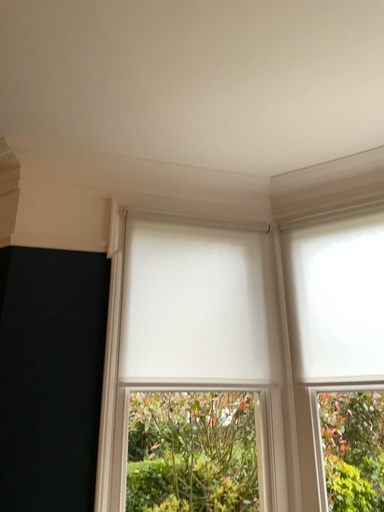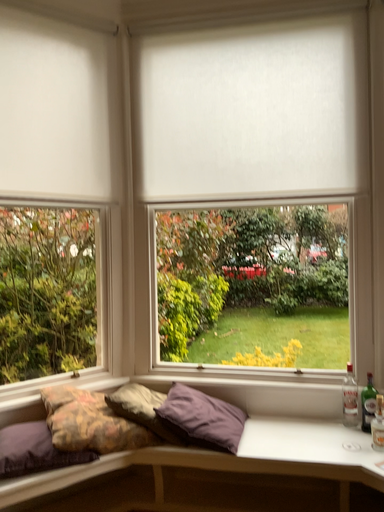
Question: How did the camera likely rotate when shooting the video?

Choices:
 (A) rotated right
 (B) rotated left

Answer: (A)